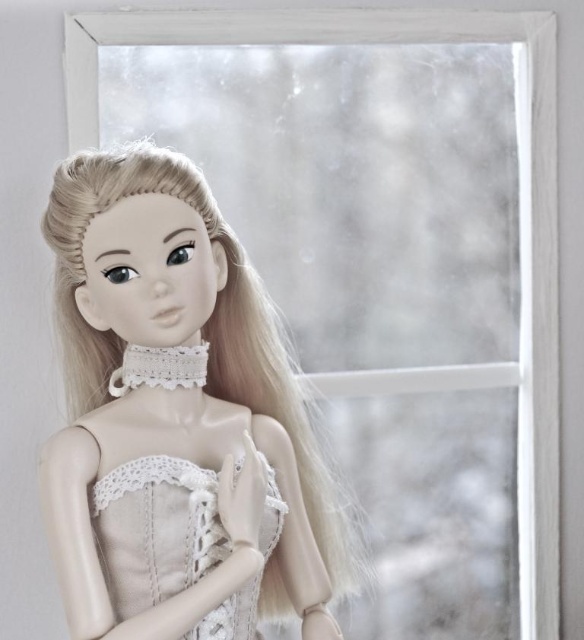
Does smooth porcelain doll at center appear over satin lace dress at center?

Yes, smooth porcelain doll at center is above satin lace dress at center.

Is smooth porcelain doll at center to the right of satin lace dress at center from the viewer's perspective?

No, smooth porcelain doll at center is not to the right of satin lace dress at center.

Between point (109, 221) and point (196, 531), which one is positioned in front?

Point (109, 221) is more forward.

At what (x,y) coordinates should I click in order to perform the action: click on smooth porcelain doll at center. Please return your answer as a coordinate pair (x, y). This screenshot has height=640, width=584. Looking at the image, I should click on (178, 420).